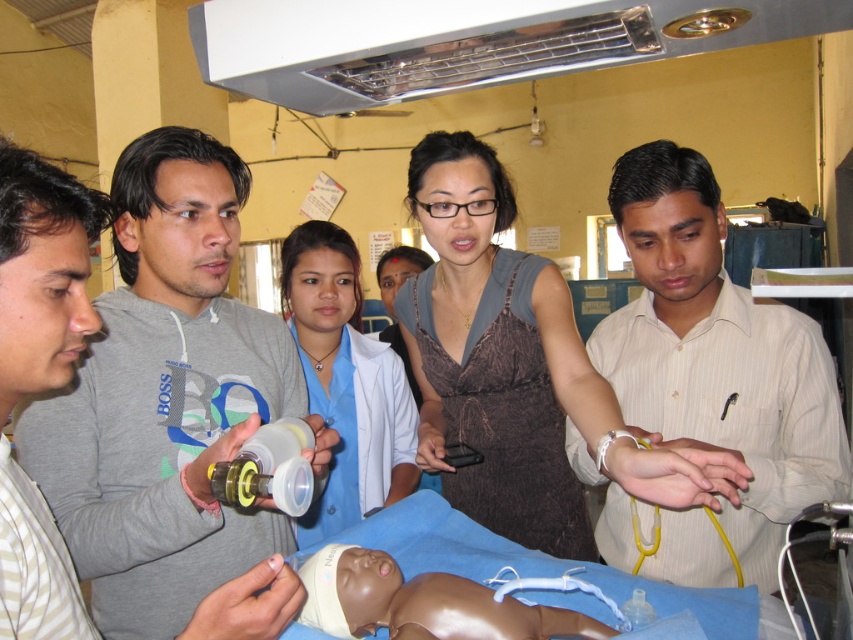
Does point (749, 529) come farther from viewer compared to point (461, 625)?

That is True.

Is white striped shirt at center to the left of brown rubber baby at center from the viewer's perspective?

In fact, white striped shirt at center is to the right of brown rubber baby at center.

Find the location of a particular element. white striped shirt at center is located at coordinates (709, 381).

This screenshot has height=640, width=853. I want to click on white striped shirt at center, so click(x=709, y=381).

Is point (155, 522) positioned in front of point (741, 296)?

Yes.

What do you see at coordinates (167, 397) in the screenshot? The height and width of the screenshot is (640, 853). I see `blue uniform at center` at bounding box center [167, 397].

Who is more distant from viewer, (277, 401) or (741, 308)?

Point (277, 401)

Identify the location of blue uniform at center. (167, 397).

Which is more to the left, blue uniform at center or brown satin dress at center?

From the viewer's perspective, blue uniform at center appears more on the left side.

Is blue uniform at center bigger than brown satin dress at center?

Actually, blue uniform at center might be smaller than brown satin dress at center.

Is point (227, 364) less distant than point (624, 444)?

That is False.

This screenshot has height=640, width=853. I want to click on blue uniform at center, so click(167, 397).